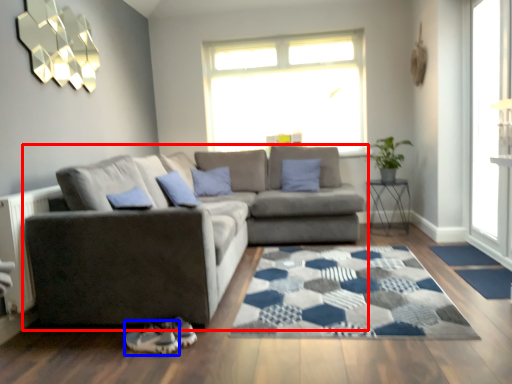
Question: Which object appears closest to the camera in this image, studio couch (highlighted by a red box) or shoe (highlighted by a blue box)?

Choices:
 (A) studio couch
 (B) shoe

Answer: (B)